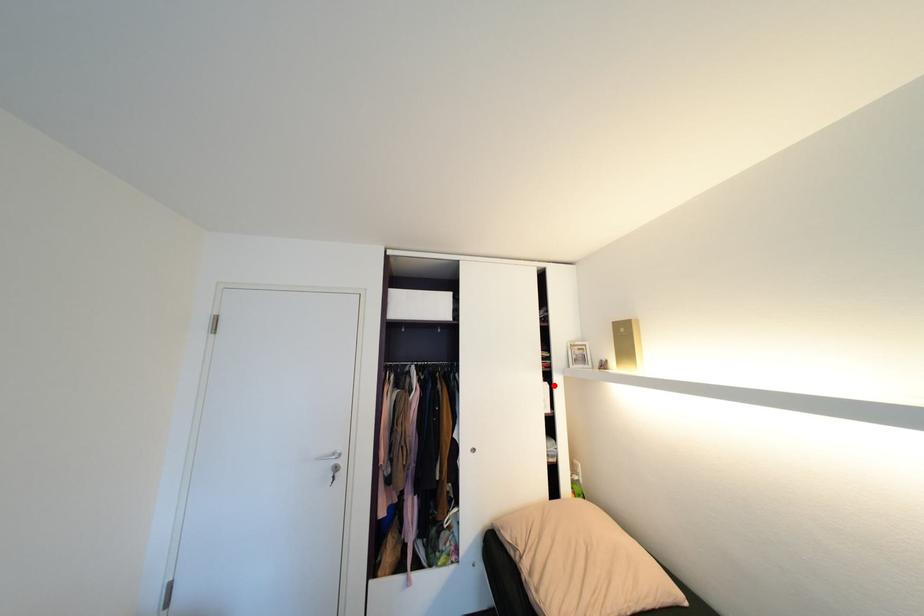
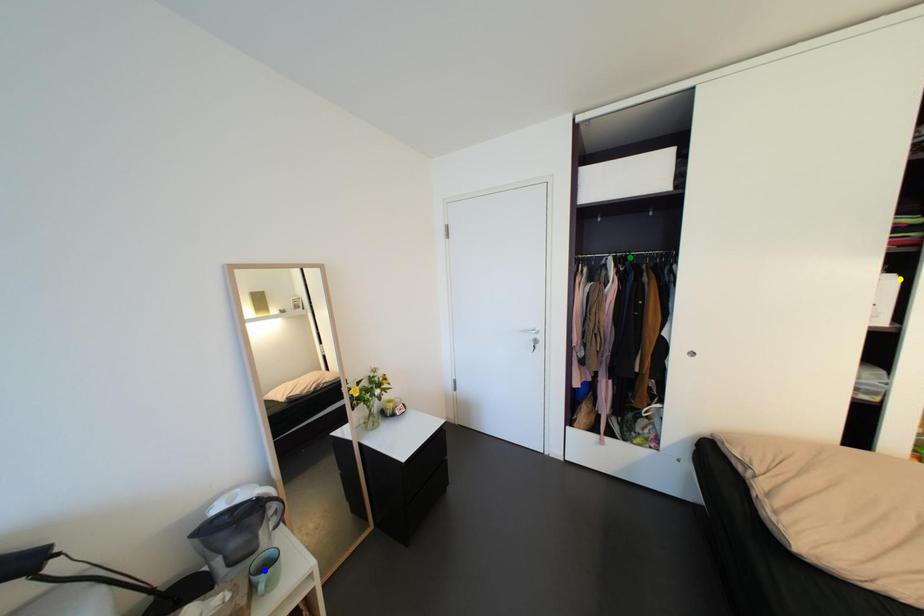
Question: I am providing you with two images of the same scene from different viewpoints. A red point is marked on the first image. You are given multiple points on the second image. Which point in image 2 represents the same 3d spot as the red point in image 1?

Choices:
 (A) yellow point
 (B) green point
 (C) blue point

Answer: (A)